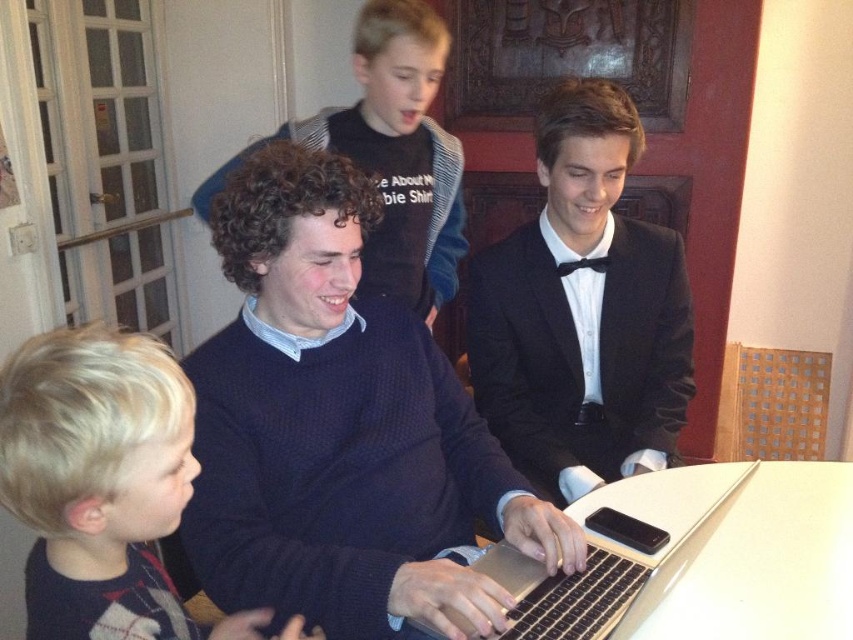
You are organizing a charity event and need to decide which item to donate based on size. The dark blue sweater at center and the black satin tuxedo at center are both available. Which item has a larger size?

The dark blue sweater at center is bigger than the black satin tuxedo at center, so the dark blue sweater at center has a larger size.

You are a fashion designer observing the two garments at the center of the image. Which one has a shorter length between the dark blue sweater at center and the black satin tuxedo at center?

The dark blue sweater at center is shorter than the black satin tuxedo at center.